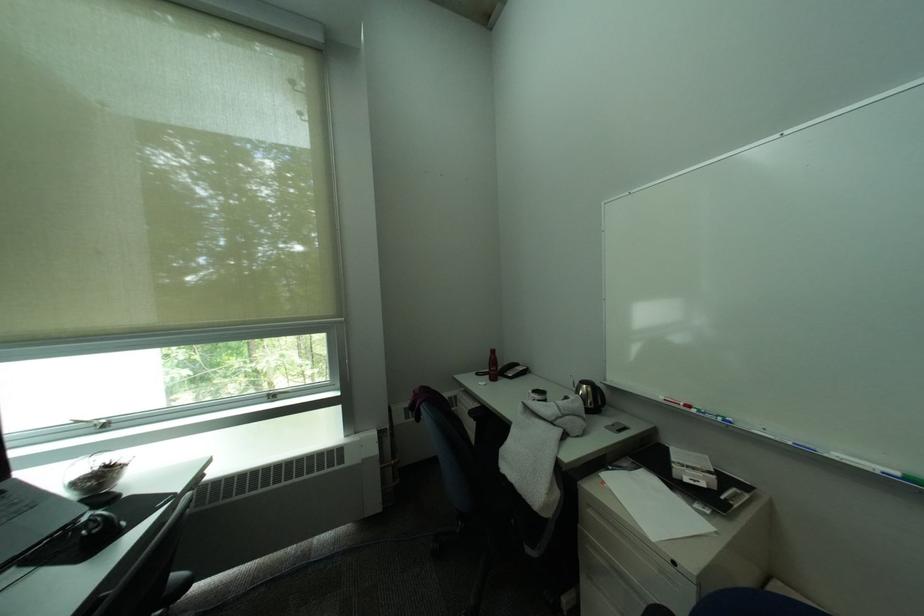
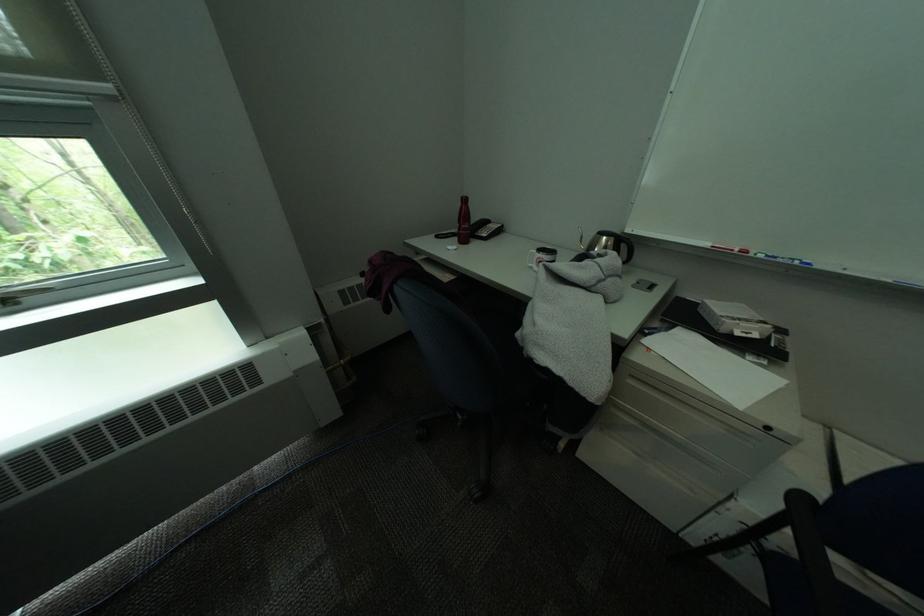
How did the camera likely rotate?

The camera rotated toward right-down.